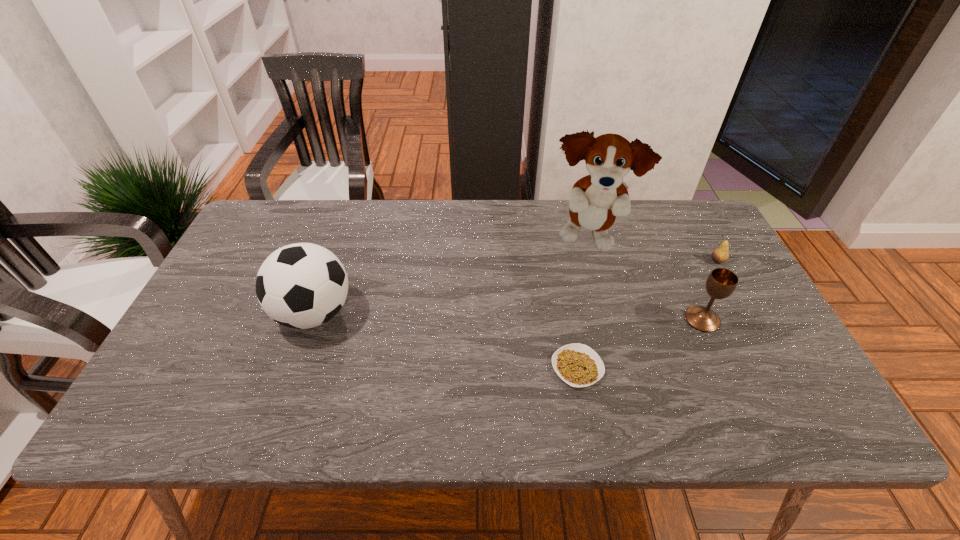
Locate an element on the screen. The height and width of the screenshot is (540, 960). the tallest object is located at coordinates (595, 200).

The width and height of the screenshot is (960, 540). Identify the location of soccer ball. (303, 285).

Image resolution: width=960 pixels, height=540 pixels. Identify the location of the leftmost object. (303, 285).

Where is `chalice`? The height and width of the screenshot is (540, 960). chalice is located at coordinates (721, 283).

The width and height of the screenshot is (960, 540). In order to click on the third shortest object in this screenshot , I will do `click(721, 283)`.

This screenshot has height=540, width=960. What are the coordinates of `pear` in the screenshot? It's located at (720, 254).

Where is `the rightmost object`? the rightmost object is located at coordinates (720, 254).

Locate an element on the screen. The image size is (960, 540). legume is located at coordinates (578, 365).

You are a GUI agent. You are given a task and a screenshot of the screen. Output one action in this format:
    pyautogui.click(x=<x>, y=<y>)
    Task: Click on the free space located on the face of the tallest object
    This screenshot has height=540, width=960.
    Given the screenshot: What is the action you would take?
    (x=624, y=378)

Where is `free location located 0.190m on the front of the leftmost object`? free location located 0.190m on the front of the leftmost object is located at coordinates (277, 420).